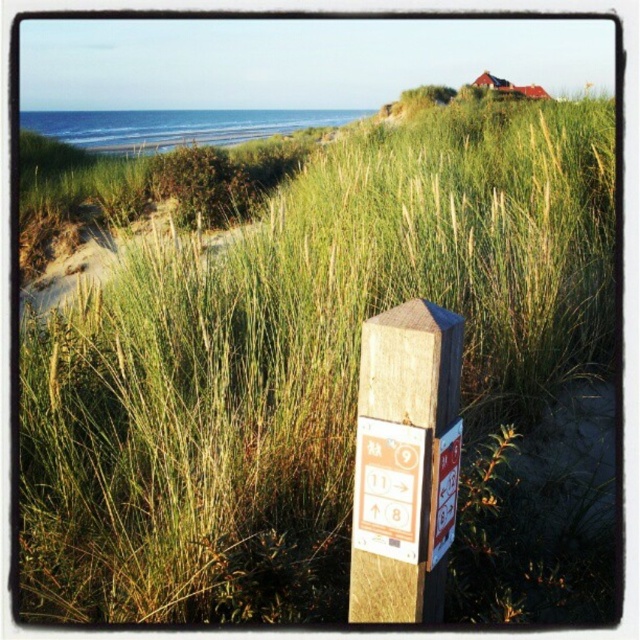
Can you confirm if wooden post at center is positioned to the left of orange paper sign at center?

In fact, wooden post at center is to the right of orange paper sign at center.

Between wooden post at center and orange paper sign at center, which one is positioned lower?

orange paper sign at center is lower down.

This screenshot has width=640, height=640. What do you see at coordinates (412, 365) in the screenshot?
I see `wooden post at center` at bounding box center [412, 365].

The height and width of the screenshot is (640, 640). What are the coordinates of `wooden post at center` in the screenshot? It's located at (412, 365).

Image resolution: width=640 pixels, height=640 pixels. In order to click on wooden post at center in this screenshot , I will do `click(412, 365)`.

Can you confirm if wooden post at center is smaller than white plastic sign at center?

Incorrect, wooden post at center is not smaller in size than white plastic sign at center.

Between point (390, 564) and point (429, 552), which one is positioned in front?

Point (429, 552)

Identify the location of wooden post at center. (412, 365).

Is the position of orange paper sign at center less distant than that of white plastic sign at center?

Yes, orange paper sign at center is in front of white plastic sign at center.

Does point (388, 545) come farther from viewer compared to point (452, 445)?

No, it is not.

Where is `orange paper sign at center`? The image size is (640, 640). orange paper sign at center is located at coordinates (388, 488).